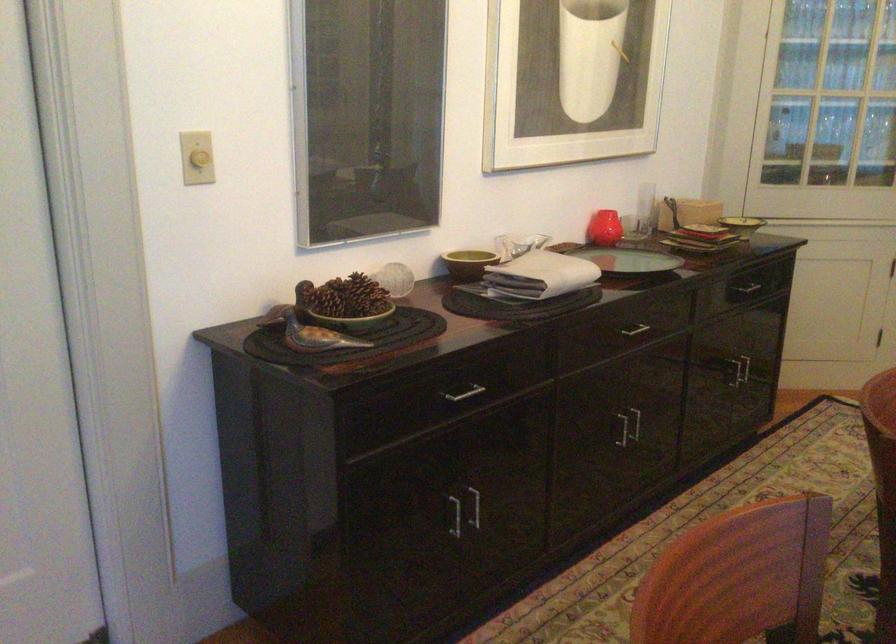
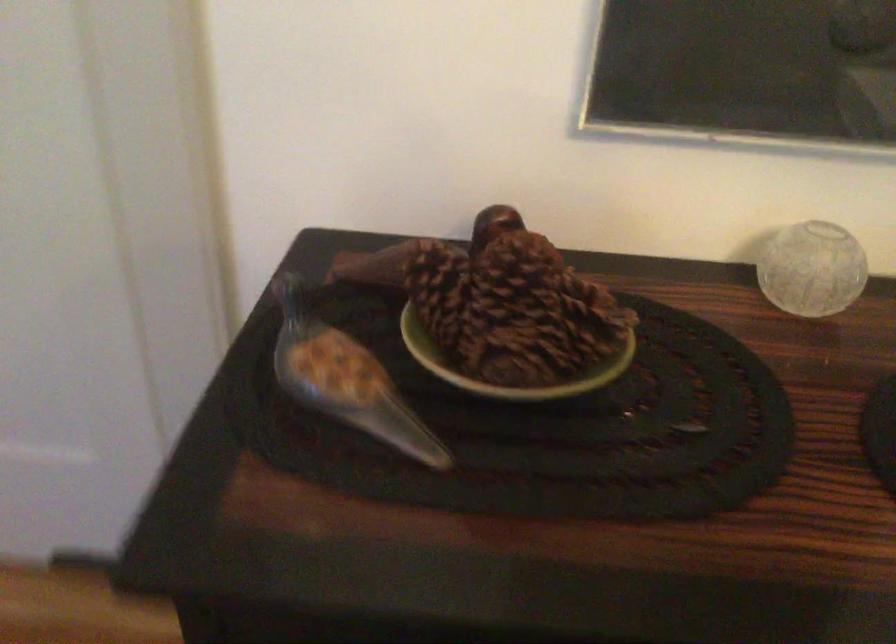
Locate, in the second image, the point that corresponds to the point at 316,296 in the first image.

(440, 292)